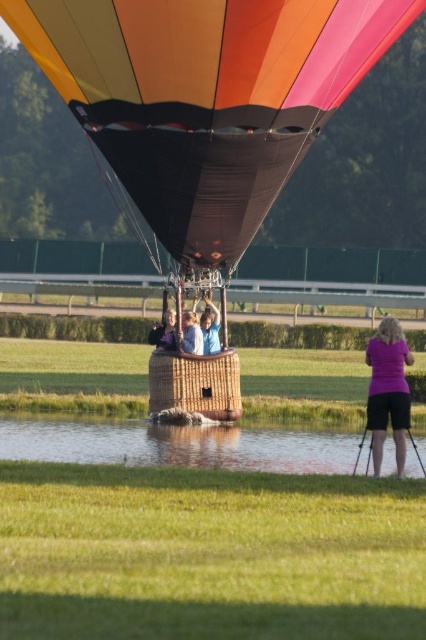
You are standing on the grassy field and see the hot air balloon in mid flight. You also notice a point marked at coordinates [175,444]. What is located at that point?

The point at coordinates [175,444] indicates clear water at lower center.

You are standing at the base of the hot air balloon basket and want to take a photo of the point at coordinates point (16, 29). If your camera can focus on objects up to 50 feet away, will you be able to capture the point clearly?

The distance of point (16, 29) from viewer is 42.87 feet, which is within the camera focus range of 50 feet. Therefore, you can capture the point clearly.